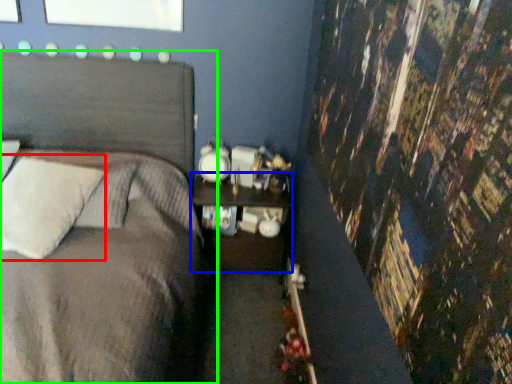
Question: Which object is the farthest from pillow (highlighted by a red box)? Choose among these: nightstand (highlighted by a blue box) or bed (highlighted by a green box).

Choices:
 (A) nightstand
 (B) bed

Answer: (A)